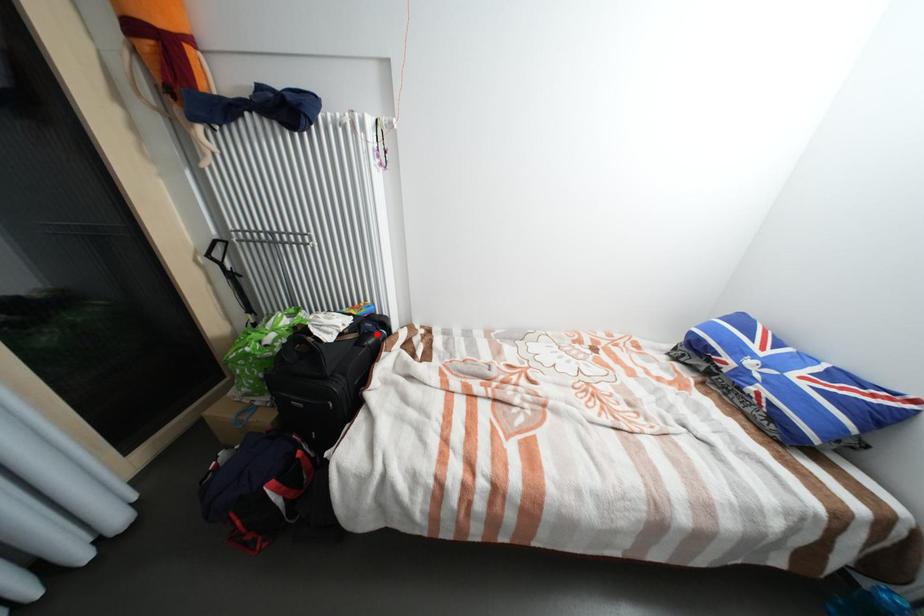
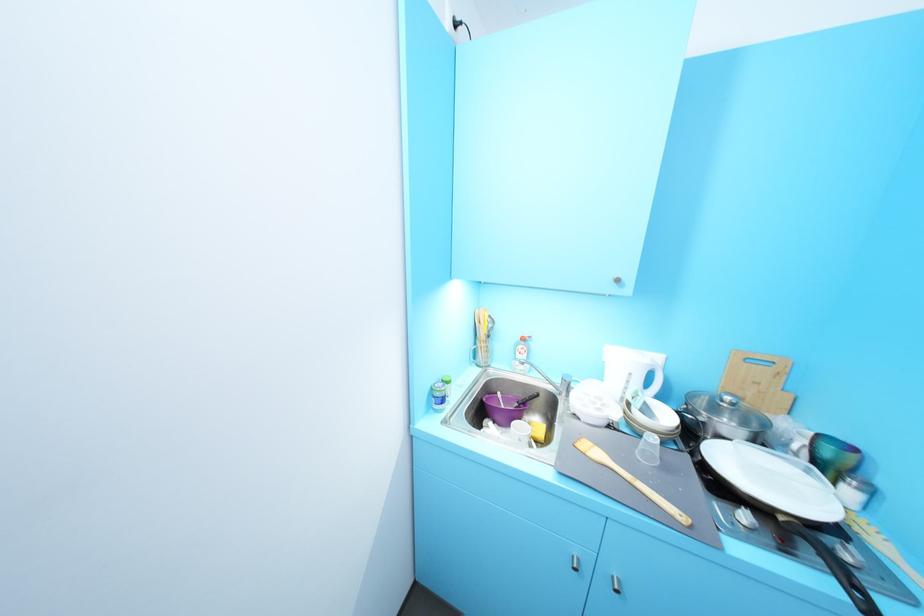
Question: I am providing you with two images of the same scene from different viewpoints. A red point is marked on the first image. At the location where the point appears in image 1, is it still visible in image 2?

Choices:
 (A) Yes
 (B) No

Answer: (B)